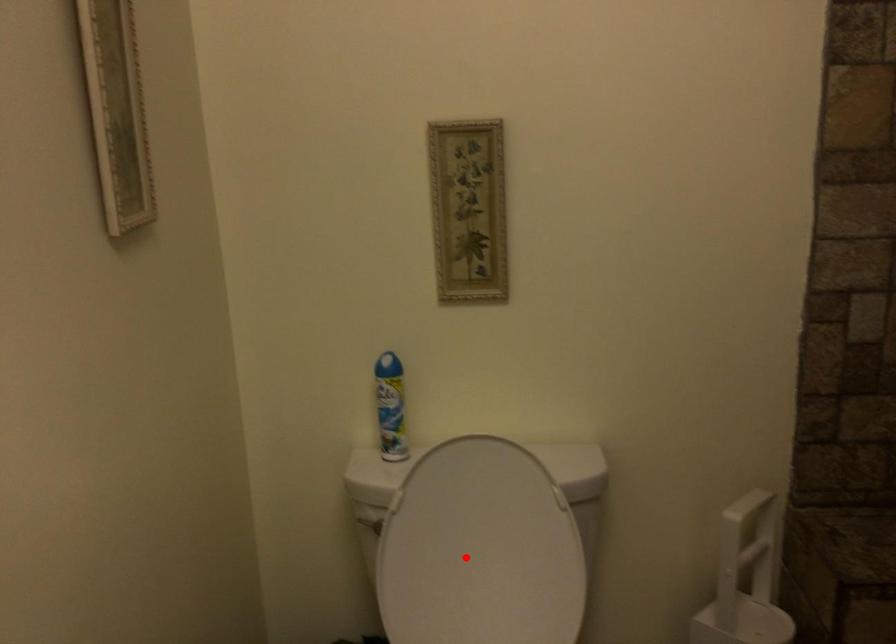
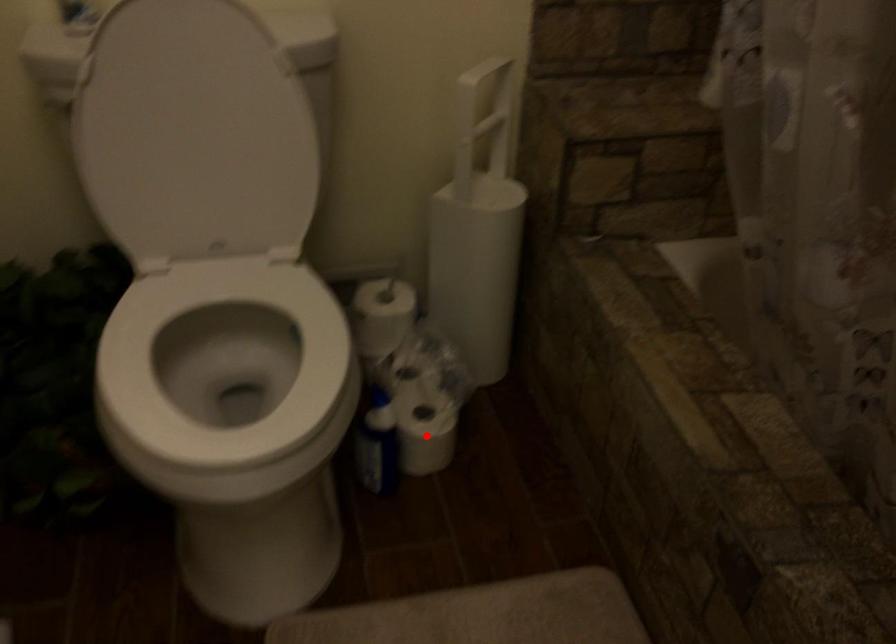
I am providing you with two images of the same scene from different viewpoints. A red point is marked on the first image and another point is marked on the second image. Are the points marked in image1 and image2 representing the same 3D position?

No